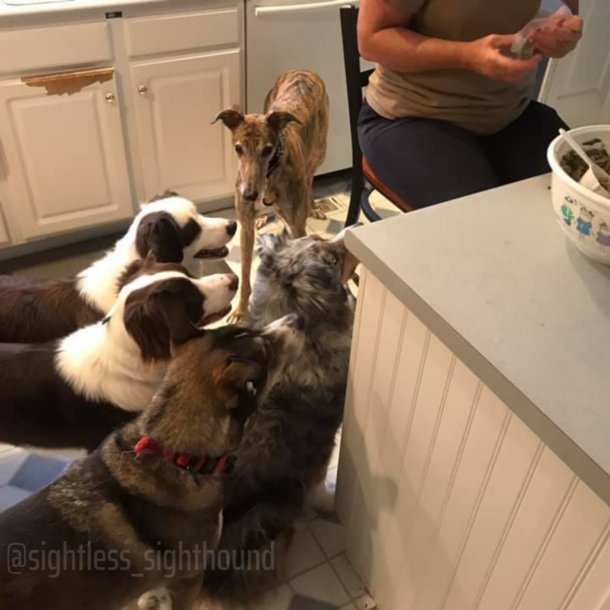
The width and height of the screenshot is (610, 610). What are the coordinates of `black back rest of chair` in the screenshot? It's located at (351, 102).